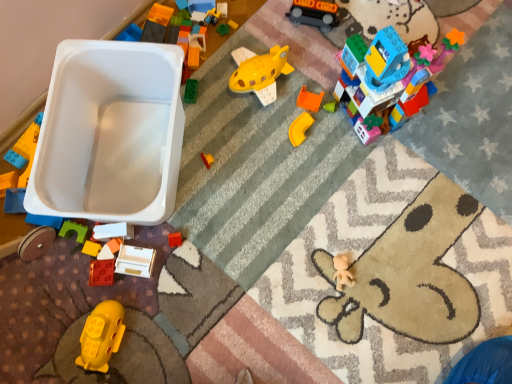
I want to click on vacant area that lies between rubberized orange block at lower left, positioned as the eighth toy in right-to-left order, and yellow matte toy submarine at lower left, the 6th toy viewed from the right, so click(98, 286).